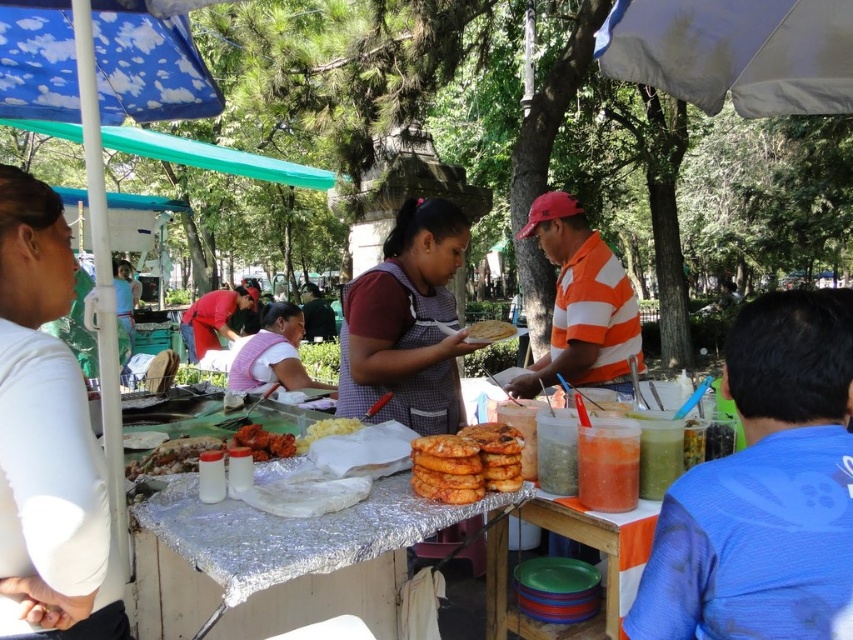
Question: Based on their relative distances, which object is nearer to the silver foil table at center?

Choices:
 (A) pink fabric shirt at center
 (B) orange striped shirt at center
 (C) maroon fabric apron at center
 (D) plastic plates at center

Answer: (D)

Question: Which object appears farthest from the camera in this image?

Choices:
 (A) golden crispy fried donuts at center
 (B) dark gray shirt at center
 (C) silver foil table at center

Answer: (B)

Question: Can you confirm if white matte shirt at left is thinner than orange striped shirt at center?

Choices:
 (A) yes
 (B) no

Answer: (A)

Question: Among these objects, which one is nearest to the camera?

Choices:
 (A) golden crispy chicken at center
 (B) blue fabric shirt at right
 (C) silver foil table at center

Answer: (B)

Question: Is white matte shirt at left to the right of white matte corn at center from the viewer's perspective?

Choices:
 (A) no
 (B) yes

Answer: (A)

Question: Is blue fabric shirt at right further to the viewer compared to white matte corn at center?

Choices:
 (A) yes
 (B) no

Answer: (B)